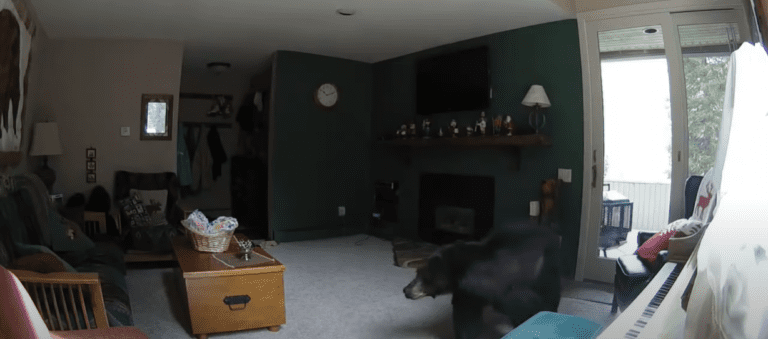
Find the location of a particular element. The width and height of the screenshot is (768, 339). coffee table is located at coordinates (257, 278).